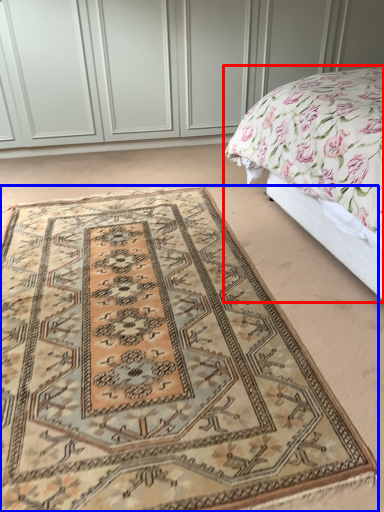
Question: Which object is closer to the camera taking this photo, bed (highlighted by a red box) or mat (highlighted by a blue box)?

Choices:
 (A) bed
 (B) mat

Answer: (B)